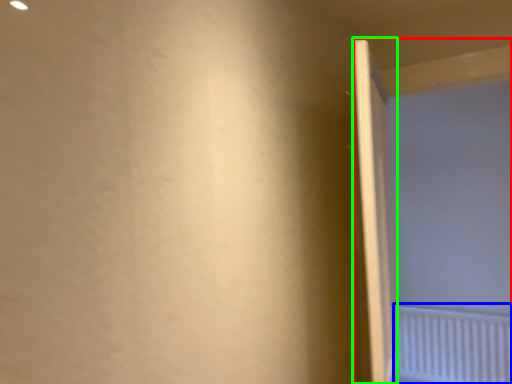
Question: Which is farther away from screen door (highlighted by a red box)? radiator (highlighted by a blue box) or door (highlighted by a green box)?

Choices:
 (A) radiator
 (B) door

Answer: (B)